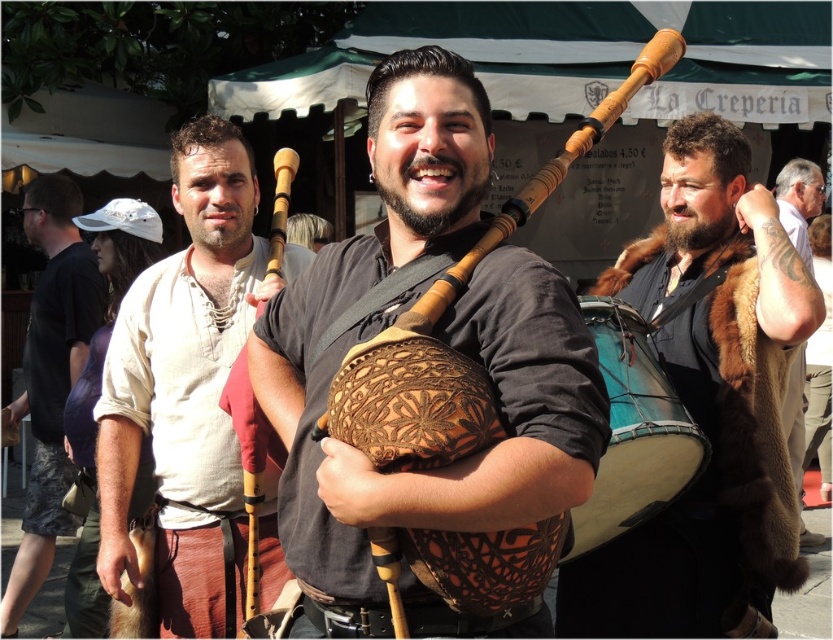
Does camouflage shorts at left appear under blue leather drum at right?

No.

Which is below, camouflage shorts at left or blue leather drum at right?

Positioned lower is blue leather drum at right.

At what (x,y) coordinates should I click in order to perform the action: click on camouflage shorts at left. Please return your answer as a coordinate pair (x, y). Looking at the image, I should click on (50, 378).

Based on the photo, between wooden bagpipe at center and dark brown fur coat at right, which one has more height?

With more height is dark brown fur coat at right.

Where is `wooden bagpipe at center`? wooden bagpipe at center is located at coordinates (252, 474).

Does point (250, 609) lie behind point (794, 234)?

No, it is in front of (794, 234).

Locate an element on the screen. The image size is (833, 640). wooden bagpipe at center is located at coordinates (252, 474).

Describe the element at coordinates (632, 432) in the screenshot. I see `blue leather drum at right` at that location.

Does blue leather drum at right have a lesser height compared to dark brown fur coat at right?

Indeed, blue leather drum at right has a lesser height compared to dark brown fur coat at right.

Is point (667, 436) closer to viewer compared to point (794, 355)?

Yes, point (667, 436) is in front of point (794, 355).

You are a GUI agent. You are given a task and a screenshot of the screen. Output one action in this format:
    pyautogui.click(x=<x>, y=<y>)
    Task: Click on the blue leather drum at right
    
    Given the screenshot: What is the action you would take?
    pos(632,432)